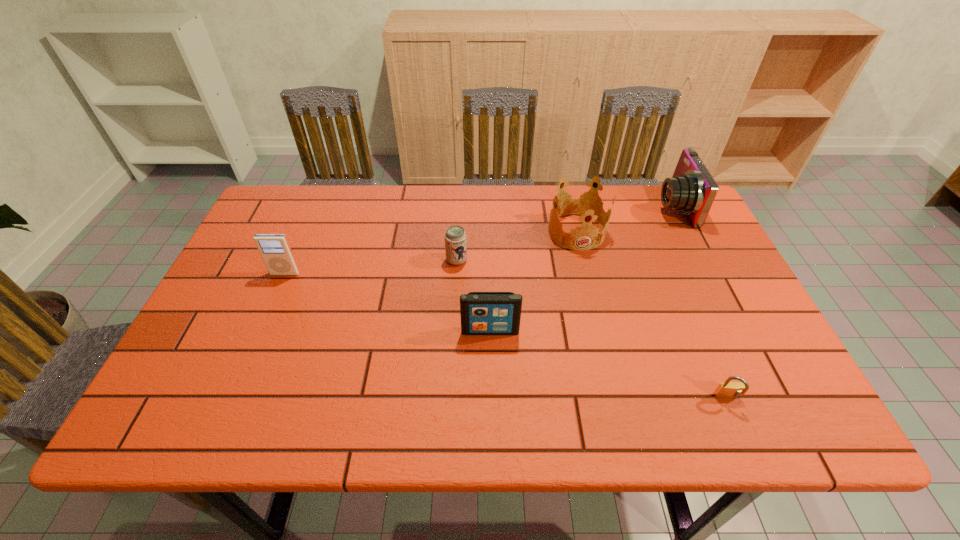
Identify the location of free location located 0.370m on the front-facing side of the camera. This screenshot has height=540, width=960. (536, 206).

You are a GUI agent. You are given a task and a screenshot of the screen. Output one action in this format:
    pyautogui.click(x=<x>, y=<y>)
    Task: Click on the blank space located on the front-facing side of the camera
    This screenshot has height=540, width=960.
    Given the screenshot: What is the action you would take?
    pyautogui.click(x=562, y=206)

Where is `blank space located 0.240m on the front-facing side of the camera`? The width and height of the screenshot is (960, 540). blank space located 0.240m on the front-facing side of the camera is located at coordinates (578, 206).

At what (x,y) coordinates should I click in order to perform the action: click on vacant space located 0.170m on the right of the crown. Please return your answer as a coordinate pair (x, y). Image resolution: width=960 pixels, height=540 pixels. Looking at the image, I should click on (663, 231).

Where is `free space located on the front-facing side of the left iPod`? The width and height of the screenshot is (960, 540). free space located on the front-facing side of the left iPod is located at coordinates (228, 406).

The height and width of the screenshot is (540, 960). Identify the location of vacant point located 0.120m on the front screen of the nearer iPod. (492, 382).

Find the location of a particular element. Image resolution: width=960 pixels, height=540 pixels. free point located 0.260m on the front of the beer can is located at coordinates (452, 348).

At what (x,y) coordinates should I click in order to perform the action: click on vacant space located on the side with the combination dials of the shortest object. Please return your answer as a coordinate pair (x, y). This screenshot has height=540, width=960. Looking at the image, I should click on (742, 434).

Image resolution: width=960 pixels, height=540 pixels. Find the location of `camera situated at the far edge`. camera situated at the far edge is located at coordinates (692, 189).

Find the location of a particular element. The height and width of the screenshot is (540, 960). crown at the far edge is located at coordinates 582,204.